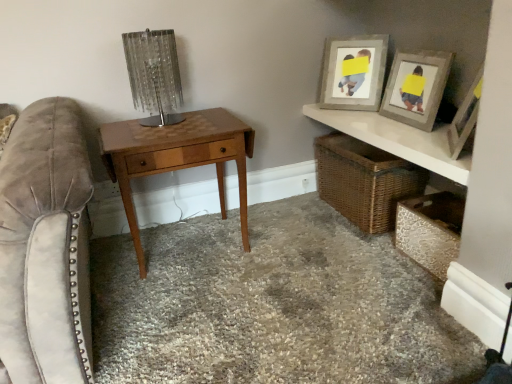
What are the coordinates of `vacant space in front of light brown wood table at center` in the screenshot? It's located at (203, 309).